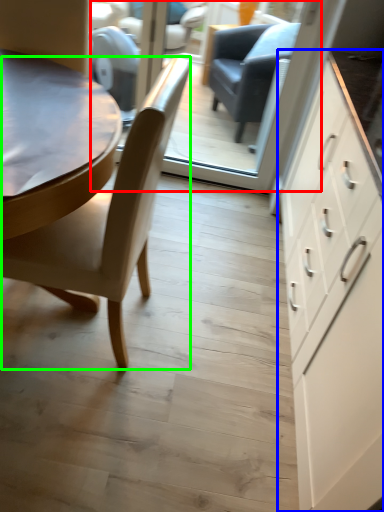
Question: Which object is the closest to the glass door (highlighted by a red box)? Choose among these: cabinetry (highlighted by a blue box) or chair (highlighted by a green box).

Choices:
 (A) cabinetry
 (B) chair

Answer: (A)